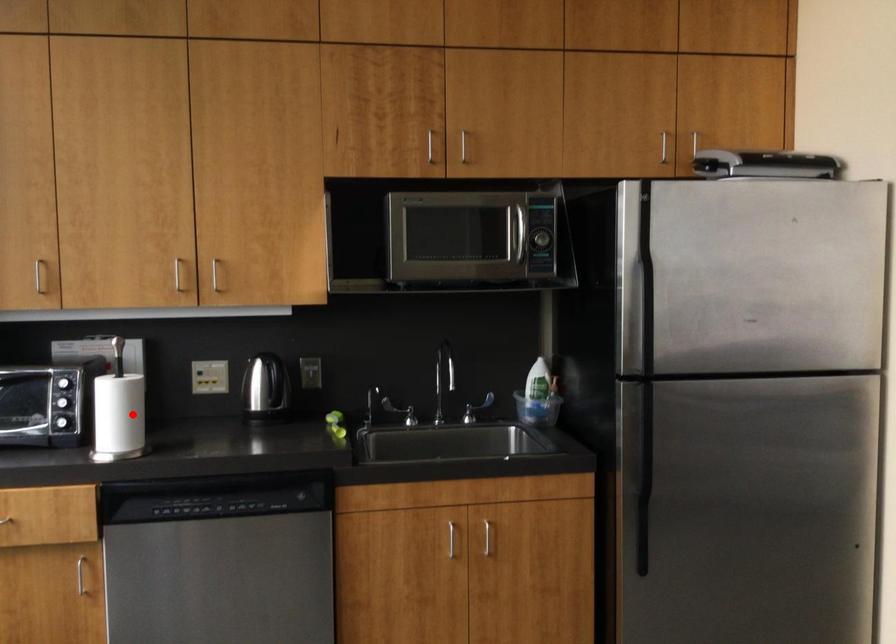
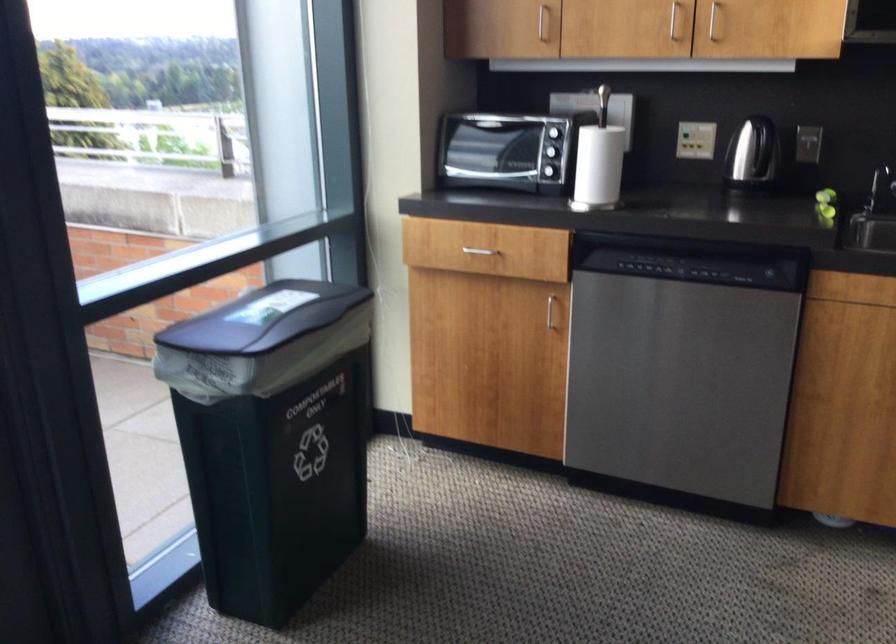
Where in the second image is the point corresponding to the highlighted location from the first image?

(599, 165)